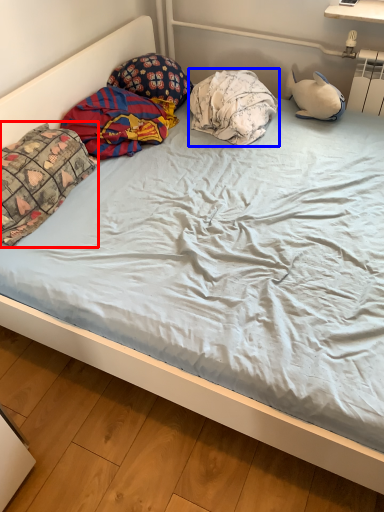
Question: Among these objects, which one is nearest to the camera, pillow (highlighted by a red box) or pillow (highlighted by a blue box)?

Choices:
 (A) pillow
 (B) pillow

Answer: (A)